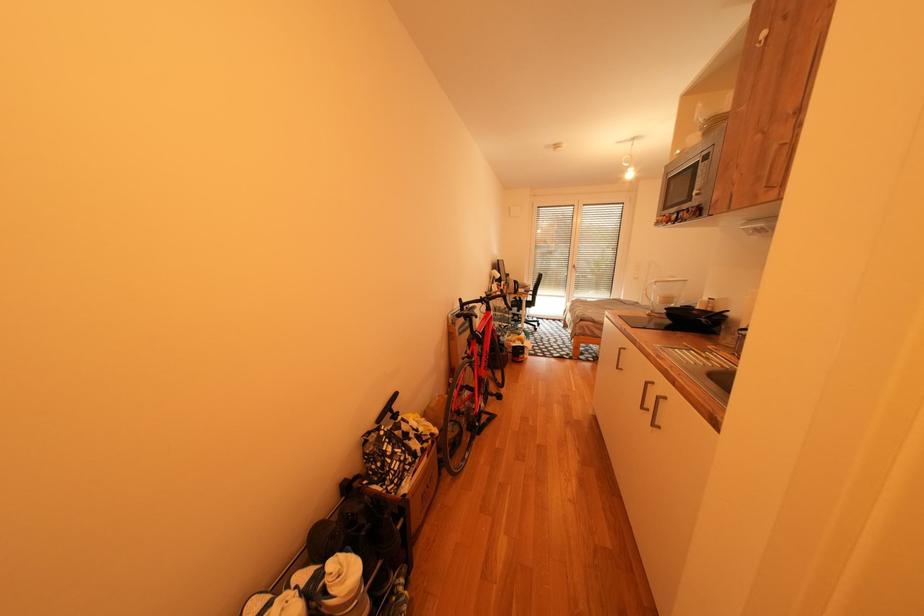
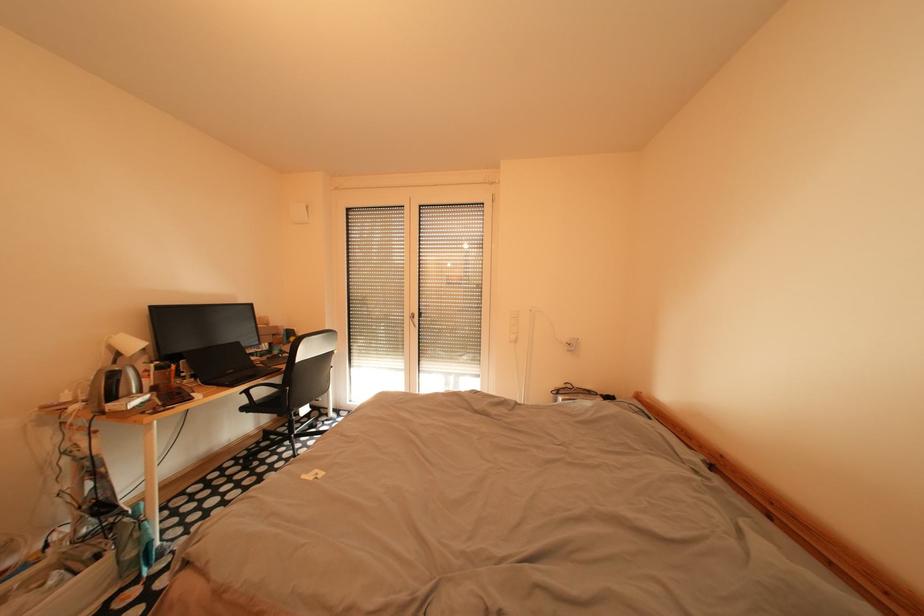
In a continuous first-person perspective shot, in which direction is the camera moving?

The cameraman walked toward right, forward.